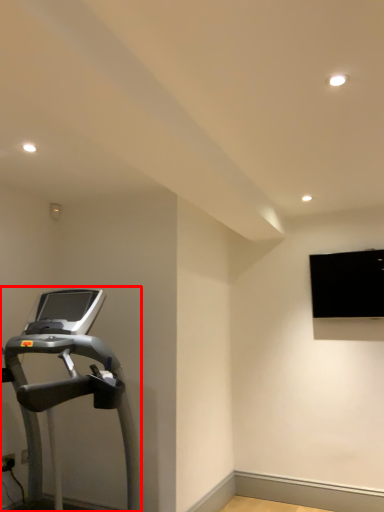
Question: Where is treadmill (annotated by the red box) located in relation to projection screen in the image?

Choices:
 (A) left
 (B) right

Answer: (A)